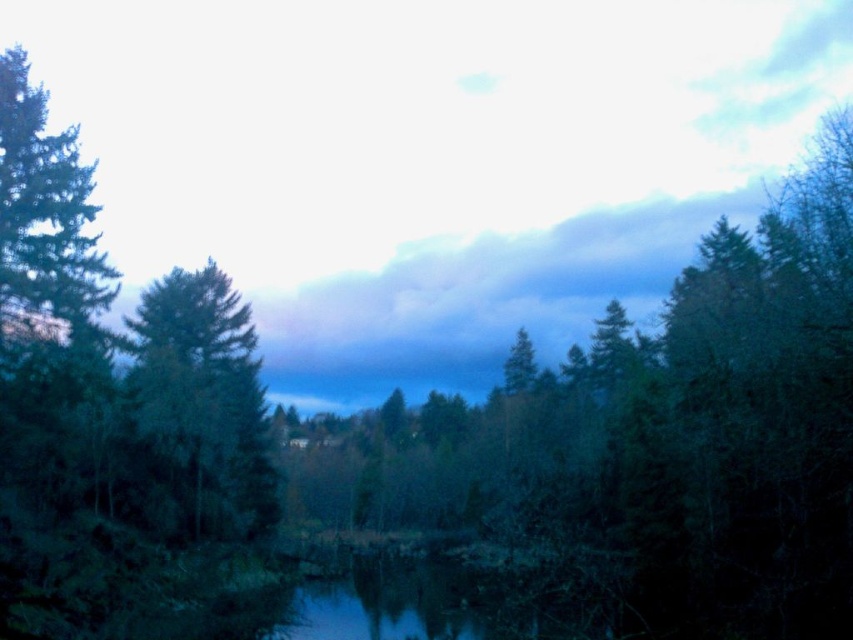
Can you confirm if green matte tree at center is positioned to the right of green matte tree at left?

Indeed, green matte tree at center is positioned on the right side of green matte tree at left.

Describe the element at coordinates (647, 449) in the screenshot. The width and height of the screenshot is (853, 640). I see `green matte tree at center` at that location.

The image size is (853, 640). Identify the location of green matte tree at center. (647, 449).